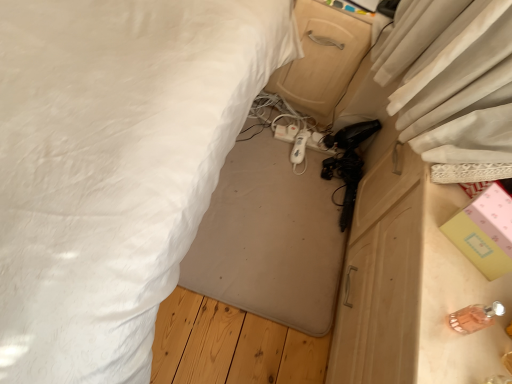
Question: Can white plastic extension cord at center be found inside white matte remote control at center, placed as the first equipment when sorted from back to front?

Choices:
 (A) yes
 (B) no

Answer: (B)

Question: Is white matte remote control at center, placed as the first equipment when sorted from back to front, outside of white plastic extension cord at center?

Choices:
 (A) no
 (B) yes

Answer: (B)

Question: Is white matte remote control at center, placed as the first equipment when sorted from back to front, further to camera compared to white plastic extension cord at center?

Choices:
 (A) no
 (B) yes

Answer: (A)

Question: Is white matte remote control at center, positioned as the first equipment in top-to-bottom order, far away from white plastic extension cord at center?

Choices:
 (A) yes
 (B) no

Answer: (B)

Question: Is white matte remote control at center, placed as the first equipment when sorted from back to front, facing towards white plastic extension cord at center?

Choices:
 (A) yes
 (B) no

Answer: (B)

Question: Relative to white matte remote control at center, the 2th equipment from the front, is translucent glass perfume bottle at lower right, arranged as the 1th equipment when viewed from the right, in front or behind?

Choices:
 (A) front
 (B) behind

Answer: (A)

Question: Considering the positions of point (481, 312) and point (302, 135), is point (481, 312) closer or farther from the camera than point (302, 135)?

Choices:
 (A) farther
 (B) closer

Answer: (B)

Question: In terms of height, does translucent glass perfume bottle at lower right, which is the 2th equipment in back-to-front order, look taller or shorter compared to white matte remote control at center, the 1th equipment from the left?

Choices:
 (A) short
 (B) tall

Answer: (B)

Question: From the image's perspective, is translucent glass perfume bottle at lower right, which is the 2th equipment in back-to-front order, above or below white matte remote control at center, the 2th equipment from the front?

Choices:
 (A) above
 (B) below

Answer: (B)

Question: Looking at their shapes, would you say translucent glass perfume bottle at lower right, the 2th equipment positioned from the left, is wider or thinner than pink paper box at right?

Choices:
 (A) wide
 (B) thin

Answer: (B)

Question: Considering the positions of point (473, 322) and point (458, 233), is point (473, 322) closer or farther from the camera than point (458, 233)?

Choices:
 (A) closer
 (B) farther

Answer: (A)

Question: Is translucent glass perfume bottle at lower right, the second equipment in the top-to-bottom sequence, inside the boundaries of pink paper box at right, or outside?

Choices:
 (A) outside
 (B) inside

Answer: (A)

Question: Is translucent glass perfume bottle at lower right, the 1th equipment ordered from the bottom, taller or shorter than pink paper box at right?

Choices:
 (A) short
 (B) tall

Answer: (A)

Question: Is white fabric bed at center to the left or to the right of translucent glass perfume bottle at lower right, the 1th equipment ordered from the bottom, in the image?

Choices:
 (A) right
 (B) left

Answer: (B)

Question: In terms of height, does white fabric bed at center look taller or shorter compared to translucent glass perfume bottle at lower right, marked as the first equipment in a front-to-back arrangement?

Choices:
 (A) short
 (B) tall

Answer: (A)